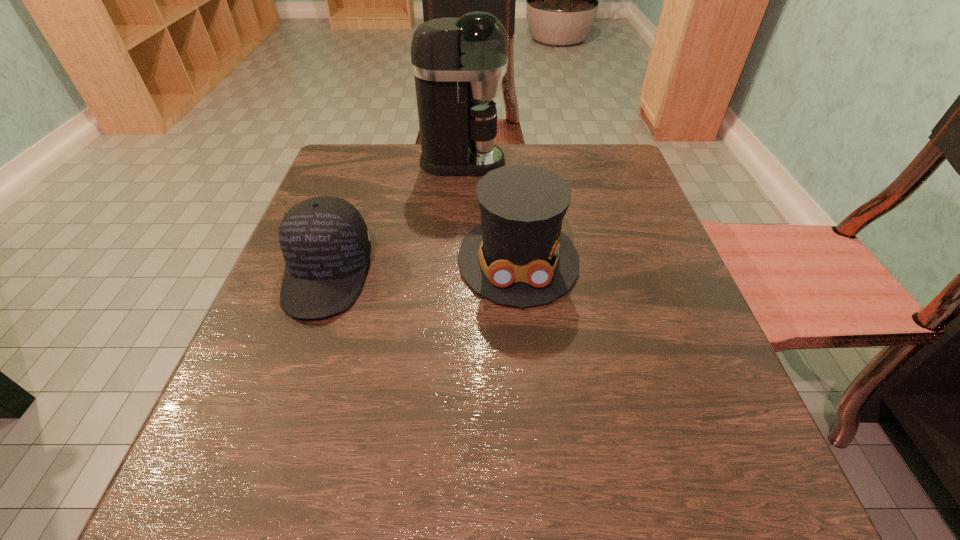
Identify the location of vacant area that lies between the baseball cap and the second tallest object. The height and width of the screenshot is (540, 960). (422, 267).

This screenshot has width=960, height=540. Identify the location of vacant point located between the shortest object and the farthest object. (395, 218).

Find the location of a particular element. The height and width of the screenshot is (540, 960). vacant area that lies between the coffee maker and the baseball cap is located at coordinates (395, 218).

At what (x,y) coordinates should I click in order to perform the action: click on blank region between the leftmost object and the dress hat. Please return your answer as a coordinate pair (x, y). Looking at the image, I should click on (422, 267).

This screenshot has height=540, width=960. Identify the location of empty space between the leftmost object and the dress hat. (422, 267).

Find the location of `vacant point located between the shortest object and the dress hat`. vacant point located between the shortest object and the dress hat is located at coordinates (422, 267).

The image size is (960, 540). What are the coordinates of `object that is the nearest to the tallest object` in the screenshot? It's located at (518, 256).

The width and height of the screenshot is (960, 540). I want to click on object that stands as the closest to the coffee maker, so click(518, 256).

Image resolution: width=960 pixels, height=540 pixels. Identify the location of vacant point that satisfies the following two spatial constraints: 1. place cup under the spout of the coffee maker; 2. at the front of the shortest object where the brim is located. (456, 275).

At what (x,y) coordinates should I click in order to perform the action: click on vacant space that satisfies the following two spatial constraints: 1. place cup under the spout of the farthest object; 2. at the front of the leftmost object where the brim is located. Please return your answer as a coordinate pair (x, y). Looking at the image, I should click on (456, 275).